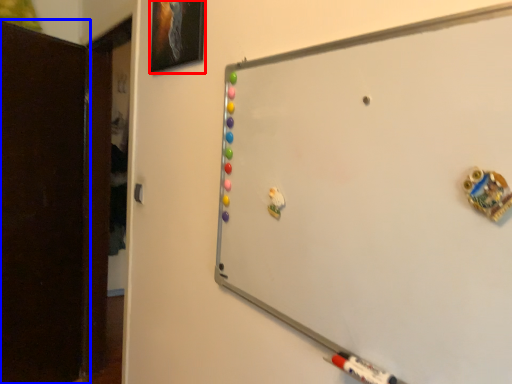
Question: Which object appears closest to the camera in this image, picture frame (highlighted by a red box) or door (highlighted by a blue box)?

Choices:
 (A) picture frame
 (B) door

Answer: (A)